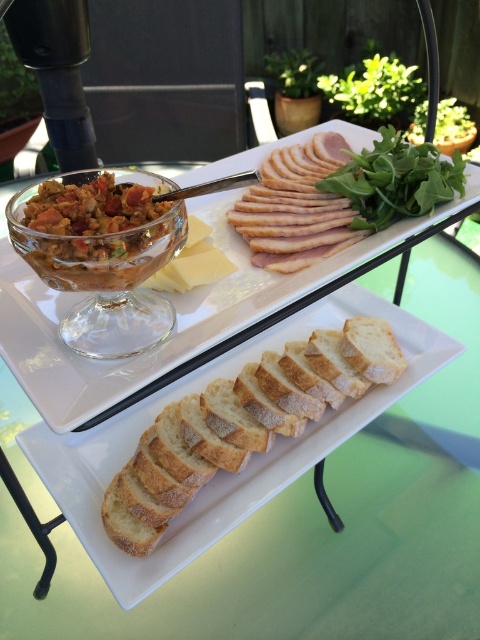
Question: Can you confirm if golden brown crusty bread at lower center is wider than yellow buttery cheese at center?

Choices:
 (A) no
 (B) yes

Answer: (B)

Question: Which of the following is the farthest from the observer?

Choices:
 (A) matte glass bowl of mixed vegetables at center-left
 (B) golden brown crusty bread at lower center

Answer: (B)

Question: Is golden brown crusty bread at center below golden brown crusty bread at lower center?

Choices:
 (A) no
 (B) yes

Answer: (A)

Question: Which point is closer to the camera?

Choices:
 (A) golden brown crusty bread at lower center
 (B) yellow buttery cheese at center

Answer: (A)

Question: Considering the relative positions of matte glass bowl of mixed vegetables at center-left and yellow buttery cheese at center in the image provided, where is matte glass bowl of mixed vegetables at center-left located with respect to yellow buttery cheese at center?

Choices:
 (A) left
 (B) right

Answer: (A)

Question: Which of the following is the farthest from the observer?

Choices:
 (A) (231, 321)
 (B) (228, 529)

Answer: (A)